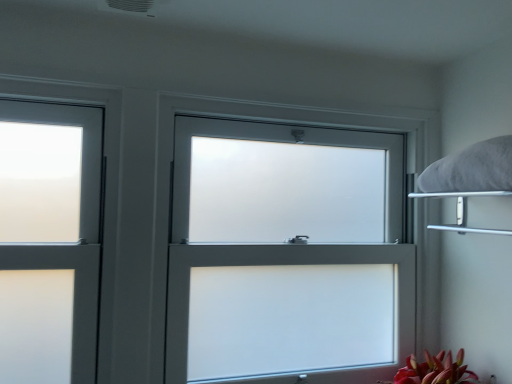
Question: Is white fluffy pillow at upper right bigger or smaller than metallic silver shelf at upper right?

Choices:
 (A) small
 (B) big

Answer: (A)

Question: From a real-world perspective, is white fluffy pillow at upper right physically located above or below metallic silver shelf at upper right?

Choices:
 (A) above
 (B) below

Answer: (A)

Question: Considering the real-world distances, which object is farthest from the metallic silver shelf at upper right?

Choices:
 (A) white frosted glass window at center
 (B) white fluffy pillow at upper right

Answer: (A)

Question: Which object is positioned closest to the white frosted glass window at center?

Choices:
 (A) metallic silver shelf at upper right
 (B) white fluffy pillow at upper right

Answer: (B)